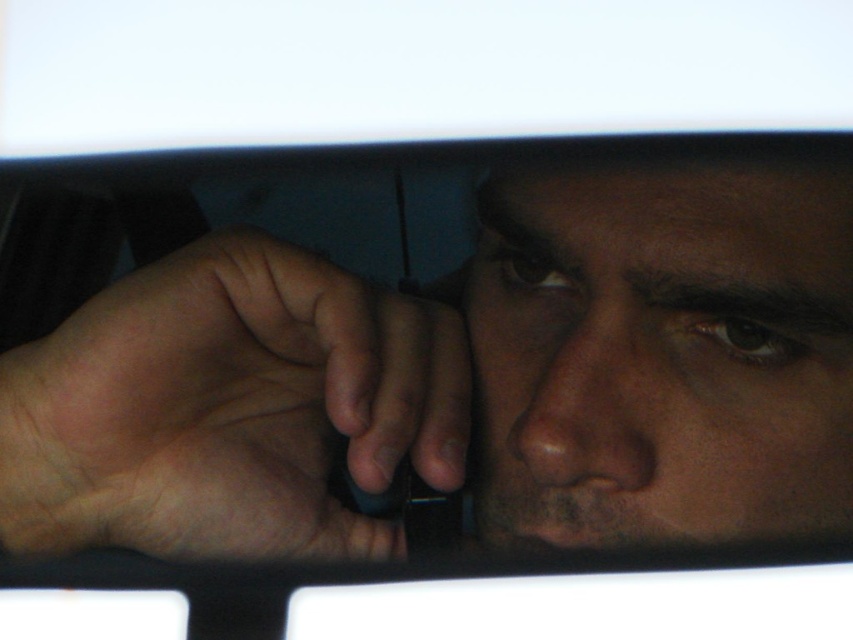
Question: Which object is farther from the camera taking this photo?

Choices:
 (A) matte black phone at center
 (B) sleek black phone at lower left
 (C) smooth skin face at center
 (D) dry skin nose at center

Answer: (D)

Question: Is matte black phone at center smaller than smooth skin face at center?

Choices:
 (A) no
 (B) yes

Answer: (A)

Question: Does matte black phone at center appear under smooth skin face at center?

Choices:
 (A) no
 (B) yes

Answer: (B)

Question: Observing the image, what is the correct spatial positioning of matte black phone at center in reference to dry skin nose at center?

Choices:
 (A) right
 (B) left

Answer: (B)

Question: Estimate the real-world distances between objects in this image. Which object is farther from the dry skin nose at center?

Choices:
 (A) smooth skin face at center
 (B) sleek black phone at lower left

Answer: (B)

Question: Which point is closer to the camera?

Choices:
 (A) (691, 468)
 (B) (605, 362)
 (C) (700, 182)
 (D) (83, 342)

Answer: (D)